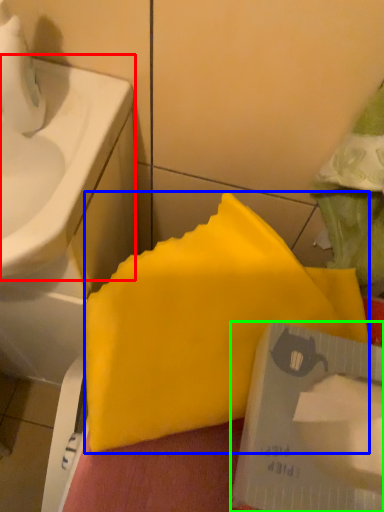
Question: Which is farther away from sink (highlighted by a red box)? waste (highlighted by a blue box) or writing (highlighted by a green box)?

Choices:
 (A) waste
 (B) writing

Answer: (B)